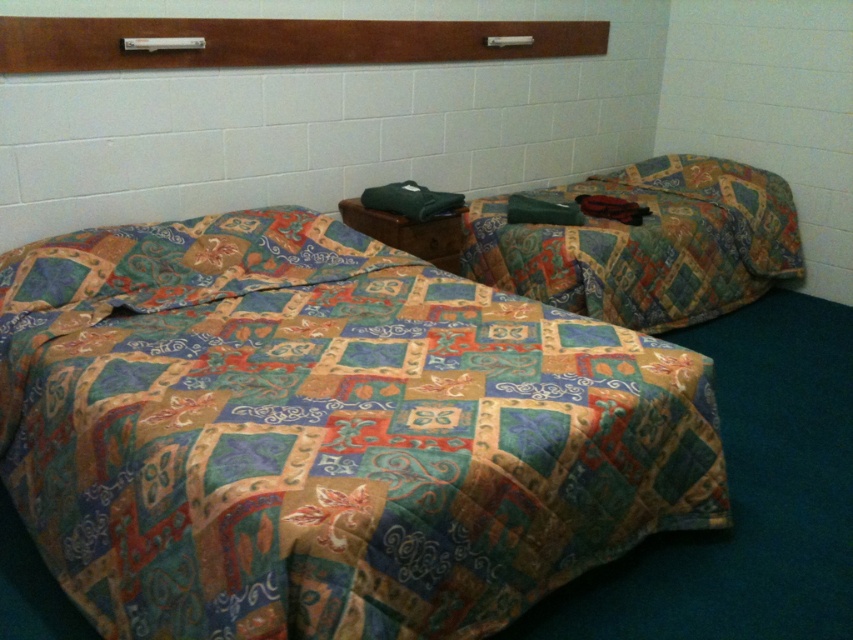
Does point (3, 275) lie behind point (717, 161)?

No, (3, 275) is in front of (717, 161).

Find the location of a particular element. This screenshot has height=640, width=853. patchwork quilt at center is located at coordinates (326, 433).